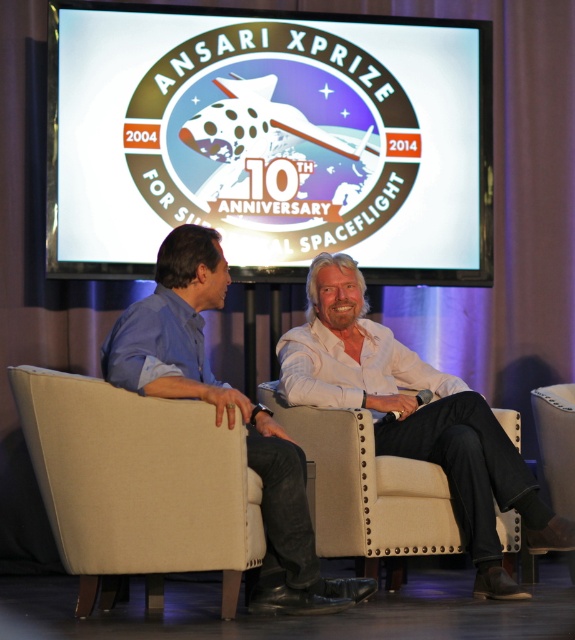
You are a photographer setting up for a group photo at the Ansari XPRIZE 10th Anniversary event. You need to position two subjects in the chairs provided. The chairs are the white leather chair at center and the beige fabric armchair at lower right. Which chair should you place the subject who prefers sitting closer to the left side of the stage?

The white leather chair at center is to the left of the beige fabric armchair at lower right, so the subject who prefers sitting closer to the left side of the stage should be placed in the white leather chair at center.